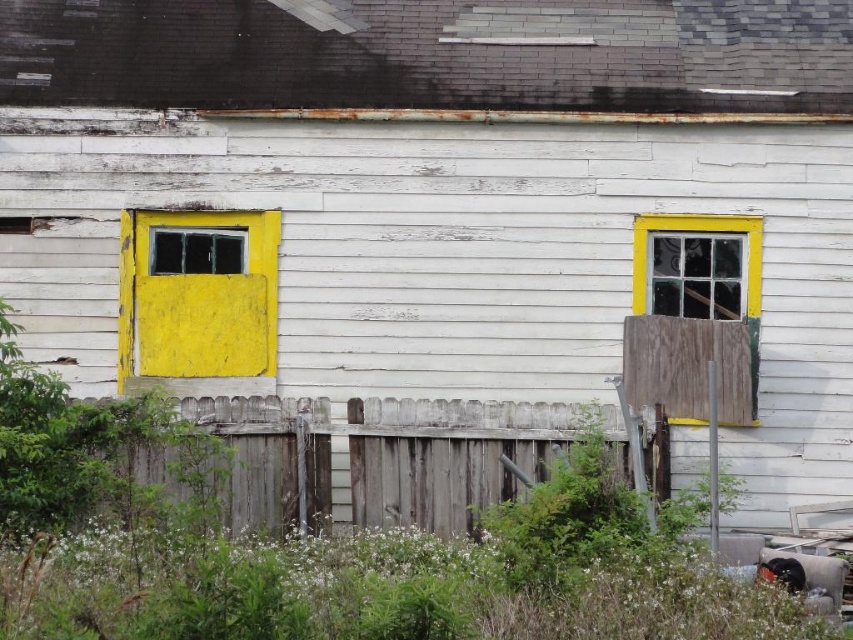
Question: Where is yellow matte door at left located in relation to clear glass window at center right in the image?

Choices:
 (A) above
 (B) below

Answer: (B)

Question: In this image, where is yellow matte door at left located relative to clear glass window at center right?

Choices:
 (A) below
 (B) above

Answer: (A)

Question: Which object is the farthest from the clear glass window at center right?

Choices:
 (A) yellow matte door at left
 (B) weathered wood fence at lower center
 (C) yellow painted wood window at left

Answer: (C)

Question: Is yellow matte door at left closer to camera compared to yellow painted wood window at left?

Choices:
 (A) yes
 (B) no

Answer: (A)

Question: Based on their relative distances, which object is nearer to the clear glass window at center right?

Choices:
 (A) yellow painted wood window at left
 (B) weathered wood fence at lower center
 (C) yellow matte door at left

Answer: (B)

Question: Which of the following is the closest to the observer?

Choices:
 (A) (670, 291)
 (B) (283, 467)
 (C) (231, 372)
 (D) (186, 236)

Answer: (B)